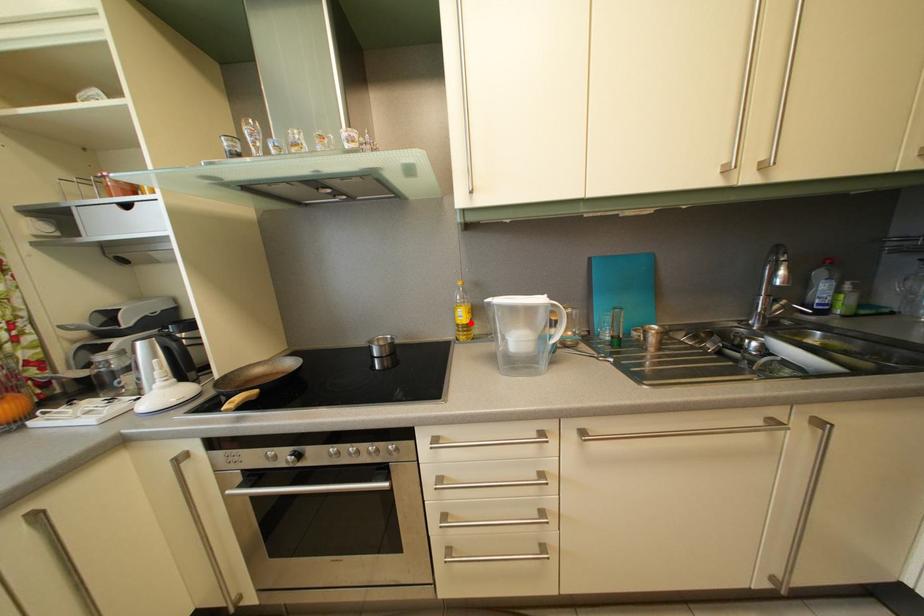
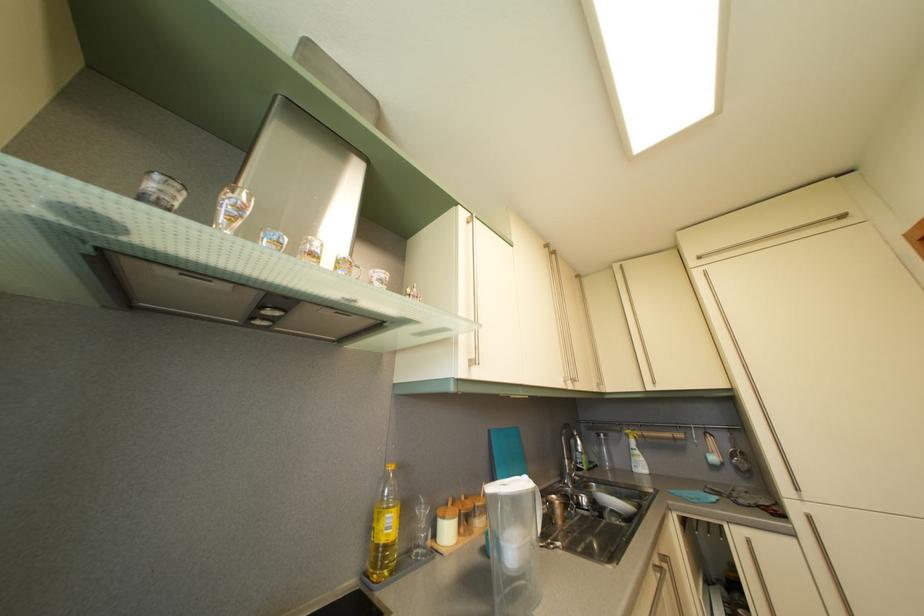
Find the pixel in the second image that matches the highlighted location in the first image.

(396, 533)